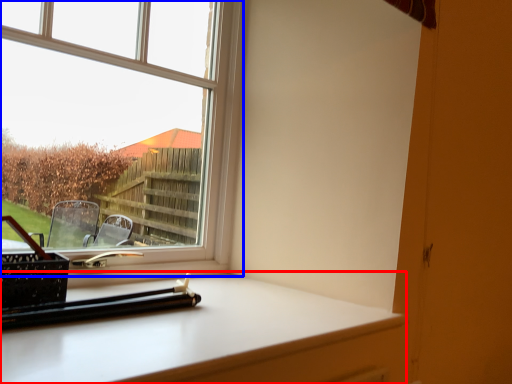
Question: Which object appears closest to the camera in this image, computer desk (highlighted by a red box) or window (highlighted by a blue box)?

Choices:
 (A) computer desk
 (B) window

Answer: (A)